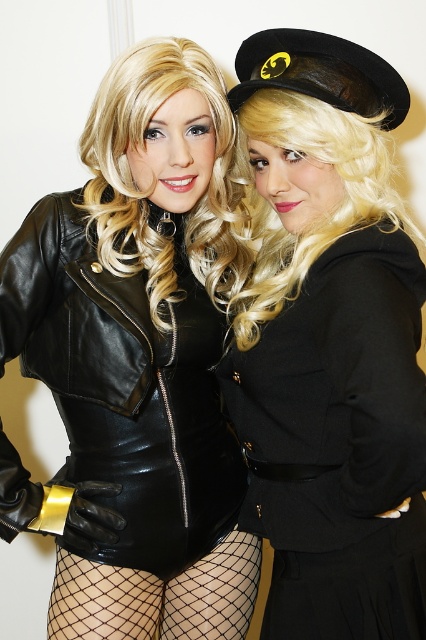
Question: Does matte black bodysuit at center appear over black woolen dress at center?

Choices:
 (A) yes
 (B) no

Answer: (A)

Question: Does matte black bodysuit at center appear on the left side of black woolen dress at center?

Choices:
 (A) yes
 (B) no

Answer: (A)

Question: Among these objects, which one is nearest to the camera?

Choices:
 (A) matte black bodysuit at center
 (B) black woolen dress at center

Answer: (B)

Question: Which point is closer to the camera taking this photo?

Choices:
 (A) 357,317
 (B) 97,433

Answer: (A)

Question: Does matte black bodysuit at center have a lesser width compared to black woolen dress at center?

Choices:
 (A) no
 (B) yes

Answer: (A)